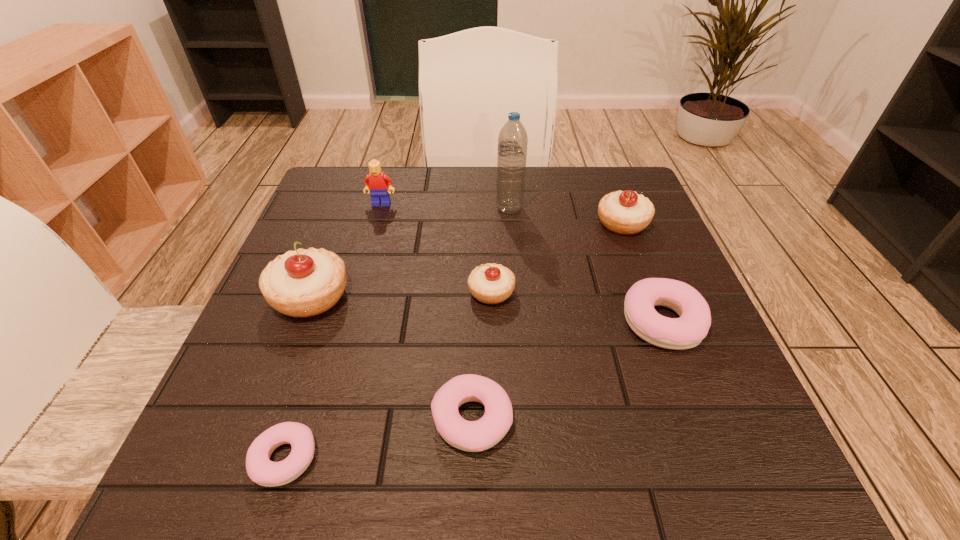
Locate an element on the screen. free space at the far edge is located at coordinates (461, 211).

Where is `free location at the near edge of the desktop`? free location at the near edge of the desktop is located at coordinates (488, 490).

At what (x,y) coordinates should I click in order to perform the action: click on vacant space at the left edge of the desktop. Please return your answer as a coordinate pair (x, y). Looking at the image, I should click on (269, 372).

In the image, there is a desktop. In order to click on vacant space at the right edge in this screenshot , I will do `click(748, 406)`.

The width and height of the screenshot is (960, 540). What are the coordinates of `vacant space at the far left corner` in the screenshot? It's located at (348, 193).

In the image, there is a desktop. Where is `vacant space at the near left corner`? The height and width of the screenshot is (540, 960). vacant space at the near left corner is located at coordinates (240, 443).

Locate an element on the screen. vacant space at the far right corner is located at coordinates (616, 189).

This screenshot has width=960, height=540. In order to click on unoccupied area between the fourth shortest object and the leftmost beige pastry in this screenshot , I will do `click(400, 293)`.

What are the coordinates of `vacant space that's between the second pink pastry from left to right and the farthest pink pastry` in the screenshot? It's located at (566, 370).

Where is `free spot between the second smallest beige pastry and the water bottle`? This screenshot has height=540, width=960. free spot between the second smallest beige pastry and the water bottle is located at coordinates (565, 215).